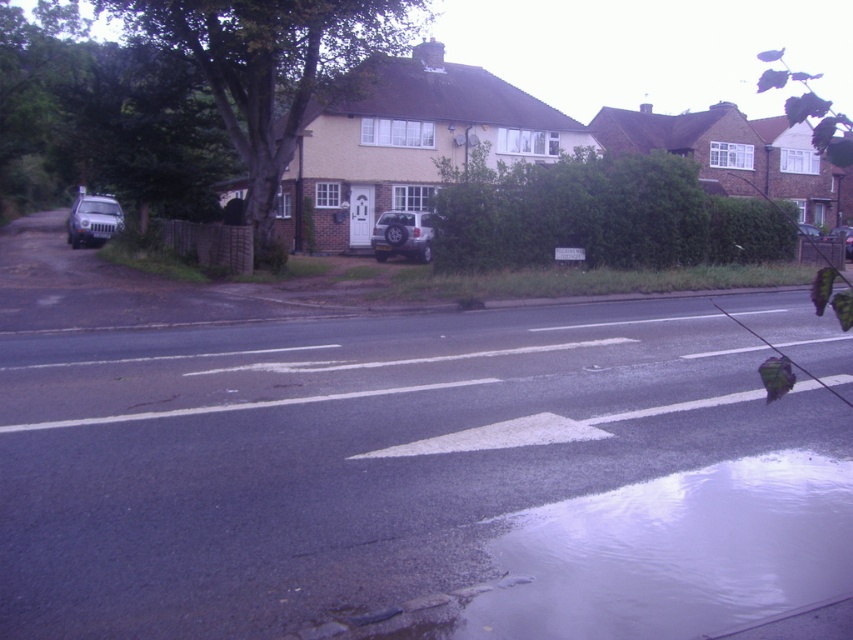
Who is more forward, (619, 582) or (851, 241)?

Point (619, 582) is more forward.

You are a GUI agent. You are given a task and a screenshot of the screen. Output one action in this format:
    pyautogui.click(x=<x>, y=<y>)
    Task: Click on the clear water at lower right
    
    Given the screenshot: What is the action you would take?
    pyautogui.click(x=653, y=560)

Locate an element on the screen. clear water at lower right is located at coordinates (653, 560).

In the scene shown: Who is taller, smooth asphalt road at center or clear water at lower right?

Standing taller between the two is smooth asphalt road at center.

What do you see at coordinates (346, 456) in the screenshot? I see `smooth asphalt road at center` at bounding box center [346, 456].

This screenshot has width=853, height=640. I want to click on smooth asphalt road at center, so click(x=346, y=456).

Can you confirm if smooth asphalt road at center is positioned above metallic silver car at center?

No.

Is smooth asphalt road at center smaller than metallic silver car at center?

Yes.

I want to click on smooth asphalt road at center, so click(x=346, y=456).